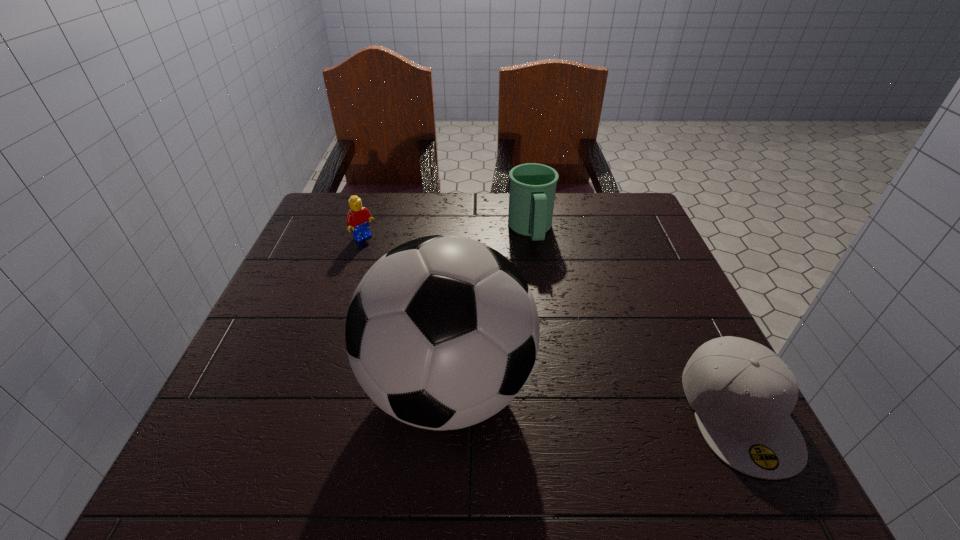
This screenshot has height=540, width=960. Identify the location of free space that is in between the rightmost object and the Lego. (551, 325).

Find the location of a particular element. Image resolution: width=960 pixels, height=540 pixels. vacant area between the soccer ball and the shortest object is located at coordinates tap(593, 399).

Locate an element on the screen. The image size is (960, 540). unoccupied position between the soccer ball and the rightmost object is located at coordinates (593, 399).

This screenshot has width=960, height=540. What are the coordinates of `unoccupied position between the cap and the Lego` in the screenshot? It's located at (551, 325).

Locate an element on the screen. vacant region between the leftmost object and the rightmost object is located at coordinates (551, 325).

Find the location of a particular element. Image resolution: width=960 pixels, height=540 pixels. vacant area that lies between the soccer ball and the shortest object is located at coordinates (593, 399).

Select which object is the closest to the shortest object. Please provide its 2D coordinates. Your answer should be formatted as a tuple, i.e. [(x, y)], where the tuple contains the x and y coordinates of a point satisfying the conditions above.

[(442, 332)]

Identify the location of object that stands as the closest to the Lego. The height and width of the screenshot is (540, 960). (442, 332).

The height and width of the screenshot is (540, 960). Identify the location of free space that satisfies the following two spatial constraints: 1. on the back side of the mug; 2. on the left side of the tallest object. (459, 231).